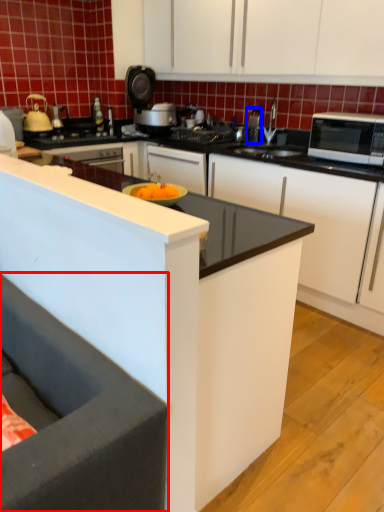
Question: Which point is closer to the camera, studio couch (highlighted by a red box) or appliance (highlighted by a blue box)?

Choices:
 (A) studio couch
 (B) appliance

Answer: (A)